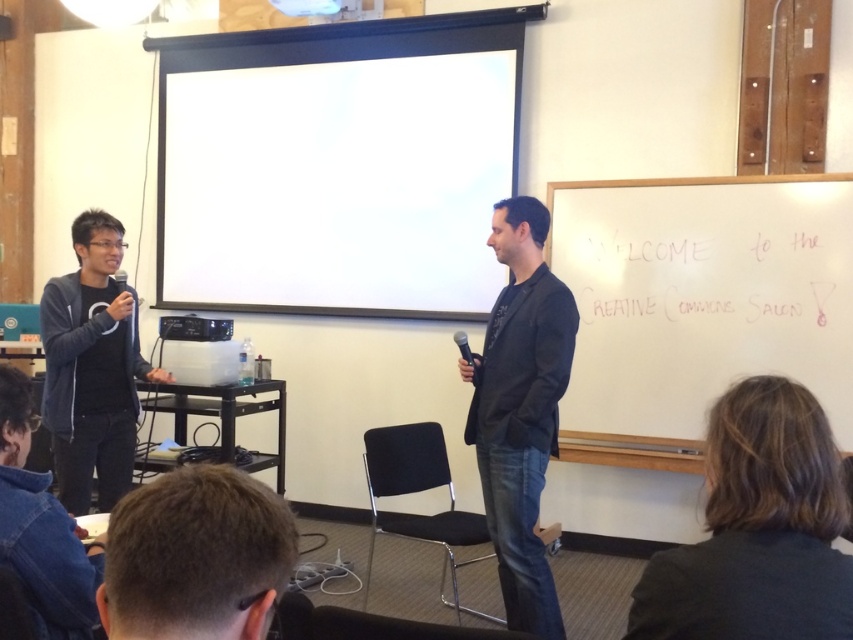
Who is more forward, (730, 476) or (39, 544)?

Point (730, 476)

From the picture: Who is lower down, dark gray suit at lower right or denim jacket at lower left?

denim jacket at lower left is lower down.

This screenshot has width=853, height=640. What do you see at coordinates (757, 529) in the screenshot? I see `dark gray suit at lower right` at bounding box center [757, 529].

Locate an element on the screen. This screenshot has width=853, height=640. dark gray suit at lower right is located at coordinates (757, 529).

The height and width of the screenshot is (640, 853). What do you see at coordinates (337, 164) in the screenshot?
I see `white matte projection screen at upper center` at bounding box center [337, 164].

Can you confirm if white matte projection screen at upper center is taller than black plastic projector at center?

Yes.

Is point (285, 49) positioned after point (228, 339)?

That is True.

Locate an element on the screen. The image size is (853, 640). white matte projection screen at upper center is located at coordinates (337, 164).

Who is lower down, white matte projection screen at upper center or black matte suit at center?

black matte suit at center is below.

Between point (233, 104) and point (526, 294), which one is positioned behind?

The point (233, 104) is behind.

What are the coordinates of `white matte projection screen at upper center` in the screenshot? It's located at (337, 164).